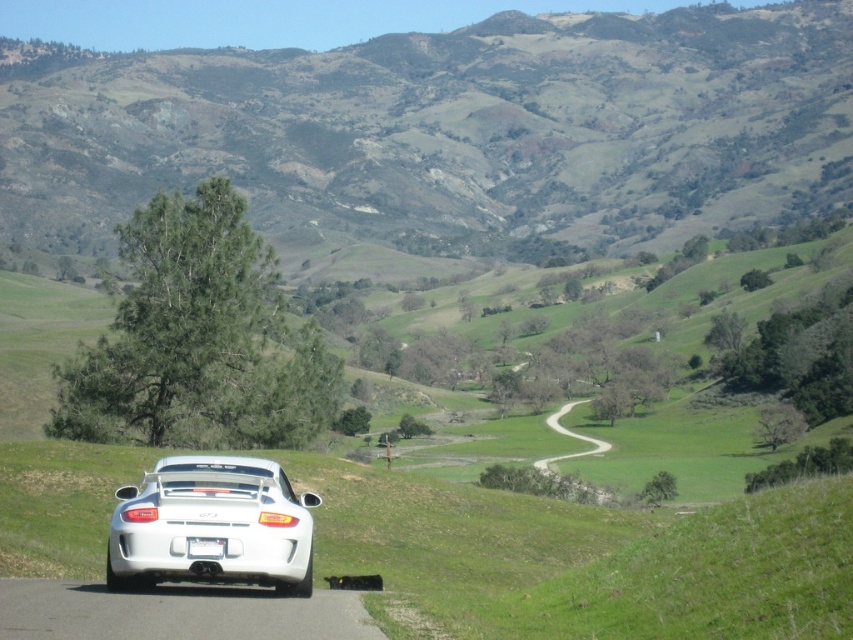
Question: Among these objects, which one is farthest from the camera?

Choices:
 (A) gravel dirt road at center
 (B) white plastic license plate at center

Answer: (A)

Question: Which of these objects is positioned farthest from the gravel dirt road at center?

Choices:
 (A) green grassy hillside at upper center
 (B) white glossy car at lower center
 (C) white plastic license plate at center

Answer: (A)

Question: Is white glossy car at lower center wider than gravel dirt road at center?

Choices:
 (A) yes
 (B) no

Answer: (B)

Question: Which object is closer to the camera taking this photo?

Choices:
 (A) gravel dirt road at center
 (B) white glossy car at lower center

Answer: (B)

Question: Is gravel dirt road at center above white plastic license plate at center?

Choices:
 (A) no
 (B) yes

Answer: (A)

Question: Is the position of green grassy hillside at upper center more distant than that of white plastic license plate at center?

Choices:
 (A) no
 (B) yes

Answer: (B)